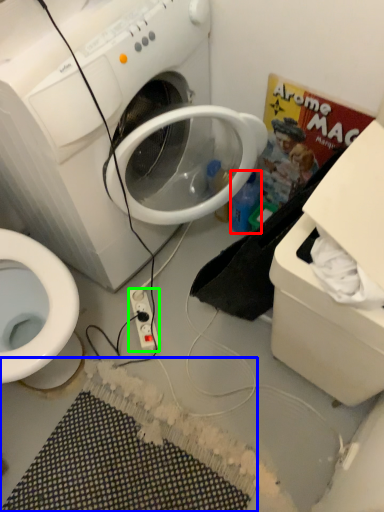
Question: Which object is the closest to the bottle (highlighted by a red box)? Choose among these: bath mat (highlighted by a blue box) or power outlet (highlighted by a green box).

Choices:
 (A) bath mat
 (B) power outlet

Answer: (B)